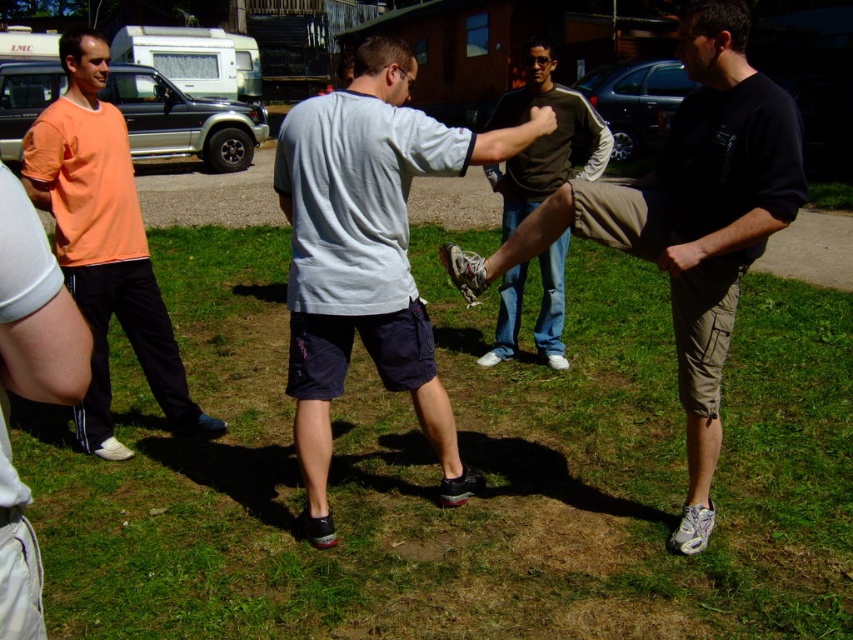
How distant is matte orange t-shirt at left from dark brown leather pants at center?

matte orange t-shirt at left and dark brown leather pants at center are 3.59 meters apart.

This screenshot has height=640, width=853. I want to click on matte orange t-shirt at left, so click(36, 308).

This screenshot has height=640, width=853. What are the coordinates of `matte orange t-shirt at left` in the screenshot? It's located at (36, 308).

Locate an element on the screen. This screenshot has height=640, width=853. matte orange t-shirt at left is located at coordinates (36, 308).

Is green grass at lower center above dark gray cotton t-shirt at center?

Actually, green grass at lower center is below dark gray cotton t-shirt at center.

Does green grass at lower center appear on the left side of dark gray cotton t-shirt at center?

Incorrect, green grass at lower center is not on the left side of dark gray cotton t-shirt at center.

Describe the element at coordinates (467, 461) in the screenshot. I see `green grass at lower center` at that location.

Where is `green grass at lower center`? green grass at lower center is located at coordinates (467, 461).

Does dark gray cotton t-shirt at center have a larger size compared to dark brown leather pants at center?

No.

Is point (329, 124) positioned behind point (561, 246)?

No, it is in front of (561, 246).

Locate an element on the screen. dark gray cotton t-shirt at center is located at coordinates (367, 253).